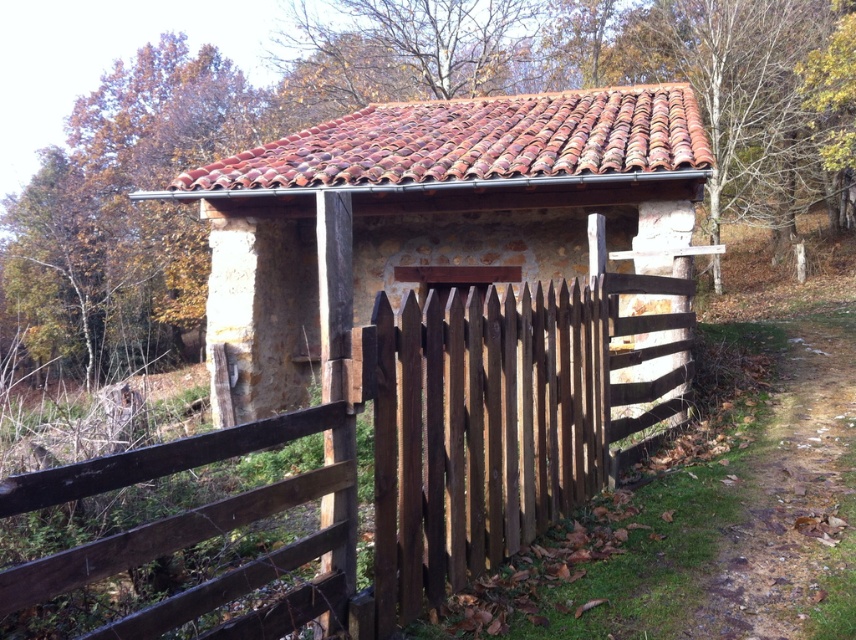
You are standing in front of the brown stone hut at center and want to walk towards the brown wooden fence at center. In which direction should you move?

You should move to your left because the brown wooden fence at center is to the left of the brown stone hut at center.